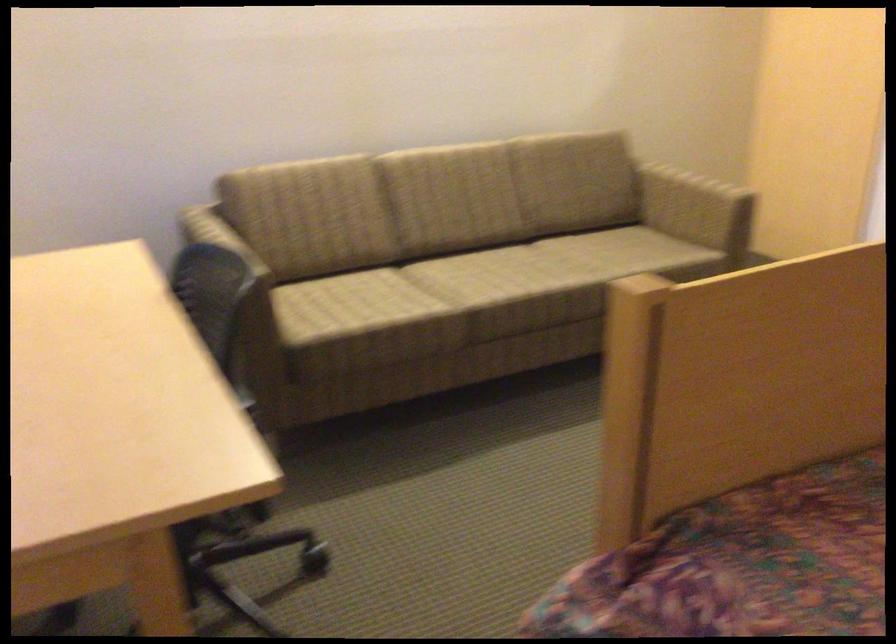
The image size is (896, 644). I want to click on sofa armrest, so click(694, 207).